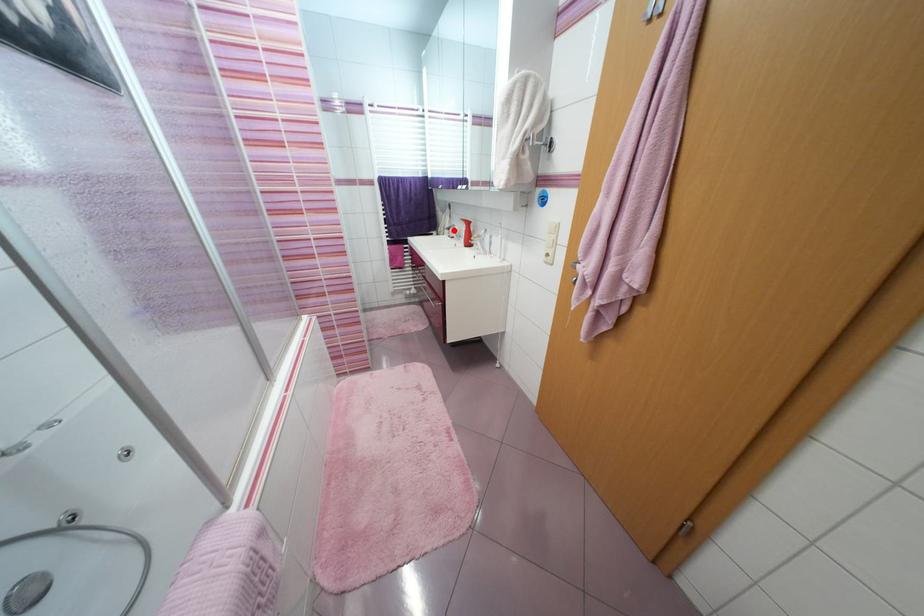
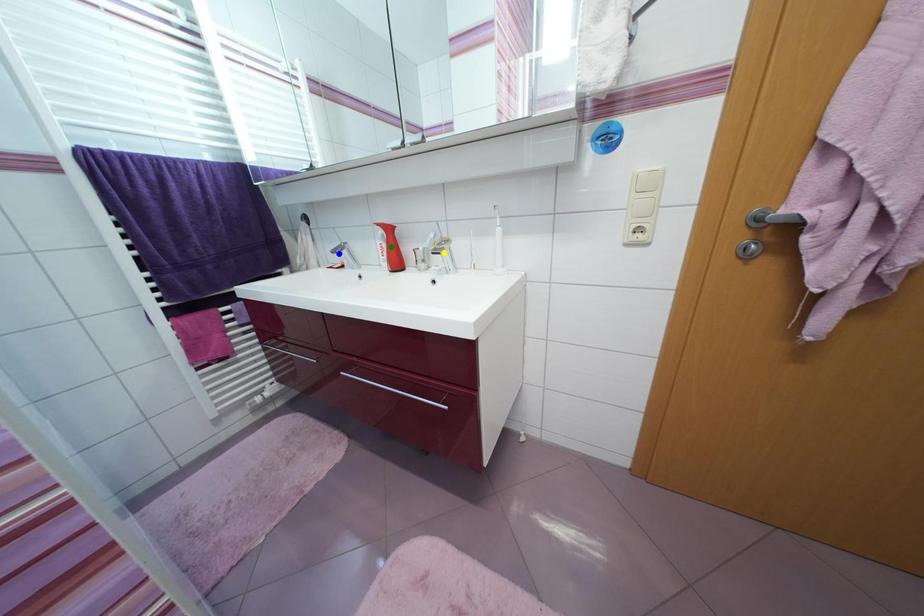
Question: I am providing you with two images of the same scene from different viewpoints. A red point is marked on the first image. You are given multiple points on the second image. Which spot in image 2 lines up with the point in image 1?

Choices:
 (A) yellow point
 (B) green point
 (C) blue point

Answer: (C)